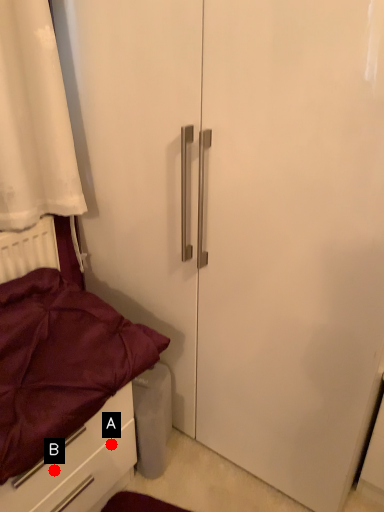
Question: Two points are circled on the image, labeled by A and B beside each circle. Which point appears farthest from the camera in this image?

Choices:
 (A) A is further
 (B) B is further

Answer: (A)